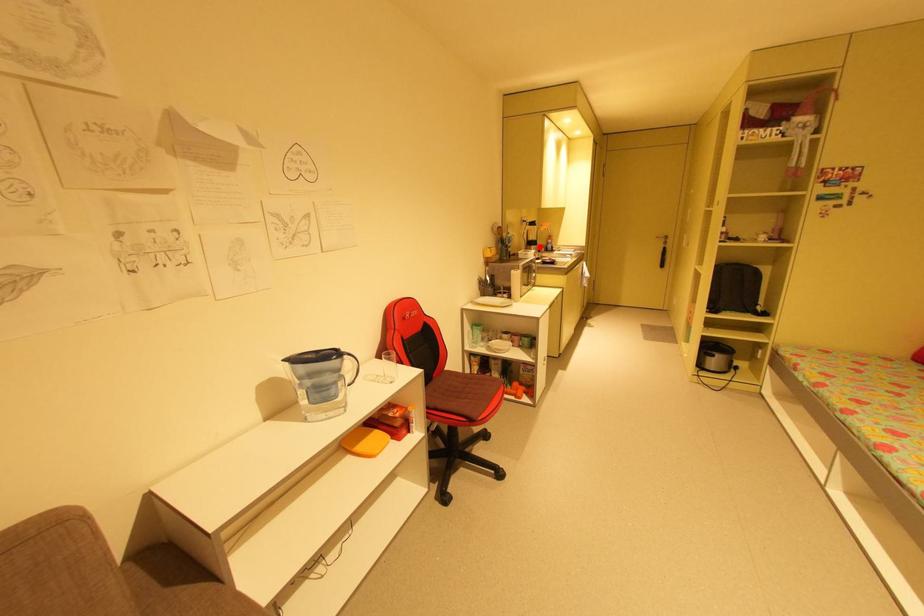
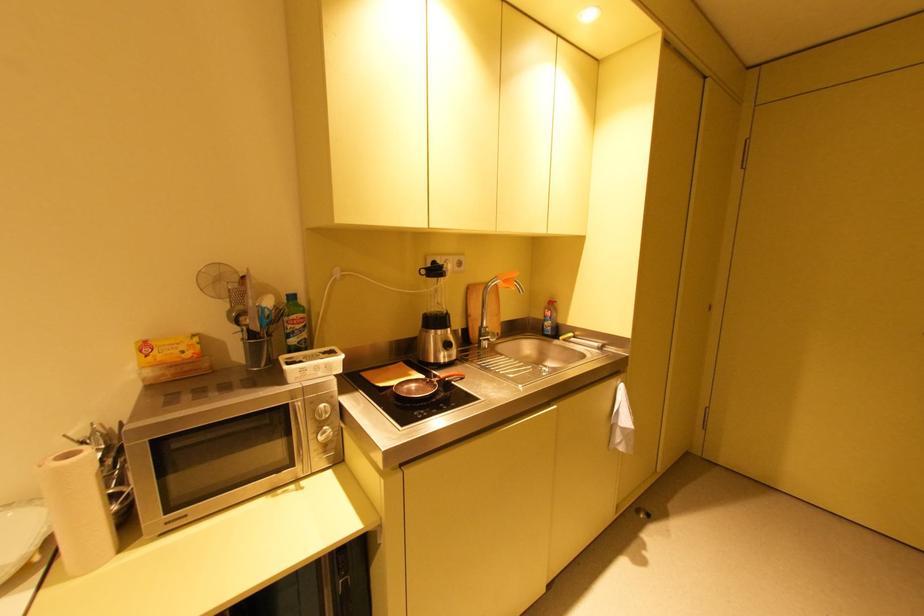
In the second image, find the point that corresponds to the highlighted location in the first image.

(444, 331)